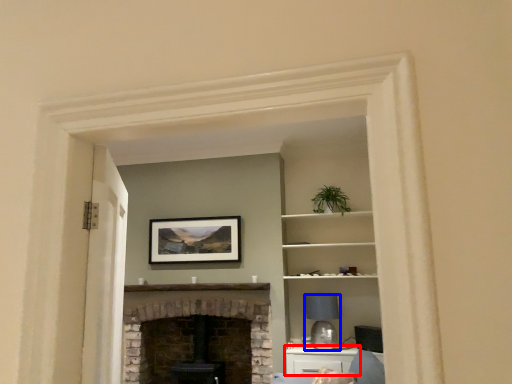
Question: Which of the following is the farthest to the observer, cabinetry (highlighted by a red box) or lamp (highlighted by a blue box)?

Choices:
 (A) cabinetry
 (B) lamp

Answer: (B)